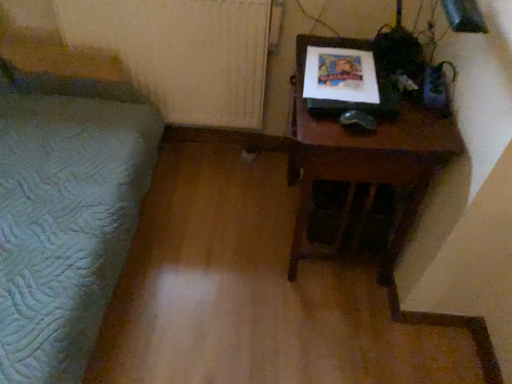
Question: Is green quilted bedspread at left positioned beyond the bounds of white textured radiator at upper left?

Choices:
 (A) yes
 (B) no

Answer: (A)

Question: From the image's perspective, is green quilted bedspread at left under white textured radiator at upper left?

Choices:
 (A) yes
 (B) no

Answer: (A)

Question: From the image's perspective, is green quilted bedspread at left above white textured radiator at upper left?

Choices:
 (A) no
 (B) yes

Answer: (A)

Question: Is green quilted bedspread at left facing towards white textured radiator at upper left?

Choices:
 (A) no
 (B) yes

Answer: (A)

Question: Is green quilted bedspread at left closer to camera compared to white textured radiator at upper left?

Choices:
 (A) yes
 (B) no

Answer: (A)

Question: Considering the relative sizes of green quilted bedspread at left and white textured radiator at upper left in the image provided, is green quilted bedspread at left smaller than white textured radiator at upper left?

Choices:
 (A) yes
 (B) no

Answer: (B)

Question: Does wooden table at right have a greater width compared to green quilted bedspread at left?

Choices:
 (A) no
 (B) yes

Answer: (A)

Question: Is wooden table at right positioned before green quilted bedspread at left?

Choices:
 (A) yes
 (B) no

Answer: (B)

Question: Is wooden table at right to the right of green quilted bedspread at left from the viewer's perspective?

Choices:
 (A) no
 (B) yes

Answer: (B)

Question: Is wooden table at right directly adjacent to green quilted bedspread at left?

Choices:
 (A) no
 (B) yes

Answer: (A)

Question: From a real-world perspective, is wooden table at right positioned over green quilted bedspread at left based on gravity?

Choices:
 (A) no
 (B) yes

Answer: (A)

Question: Is wooden table at right taller than green quilted bedspread at left?

Choices:
 (A) no
 (B) yes

Answer: (A)

Question: From the image's perspective, is green quilted bedspread at left below wooden table at right?

Choices:
 (A) no
 (B) yes

Answer: (A)